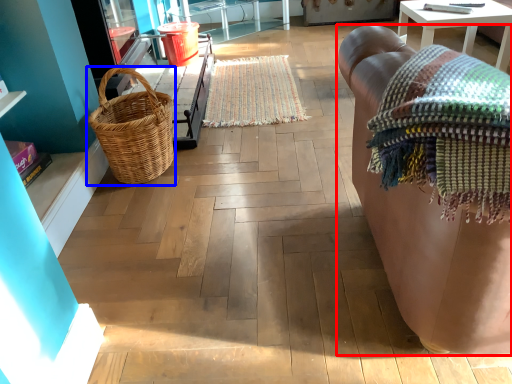
Question: Which object is closer to the camera taking this photo, studio couch (highlighted by a red box) or picnic basket (highlighted by a blue box)?

Choices:
 (A) studio couch
 (B) picnic basket

Answer: (A)